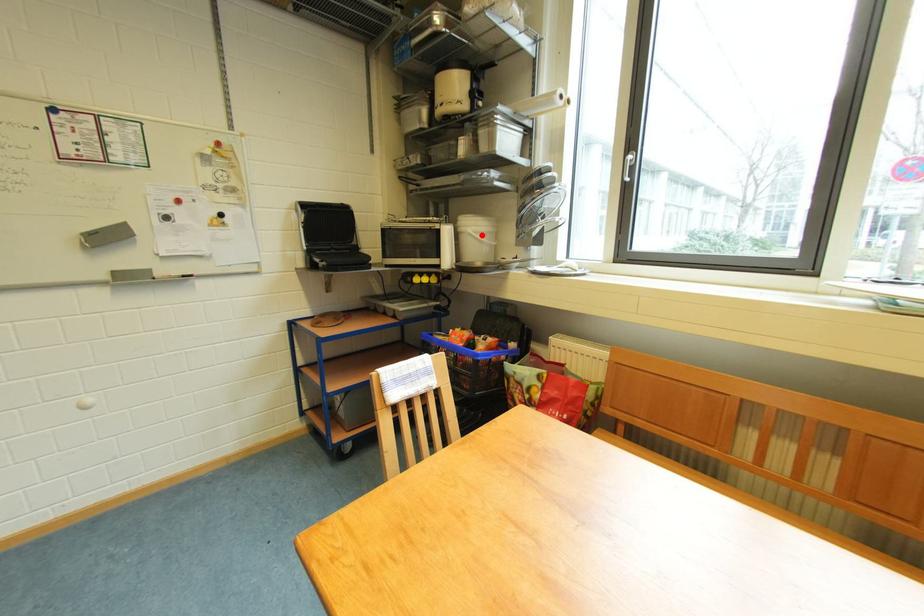
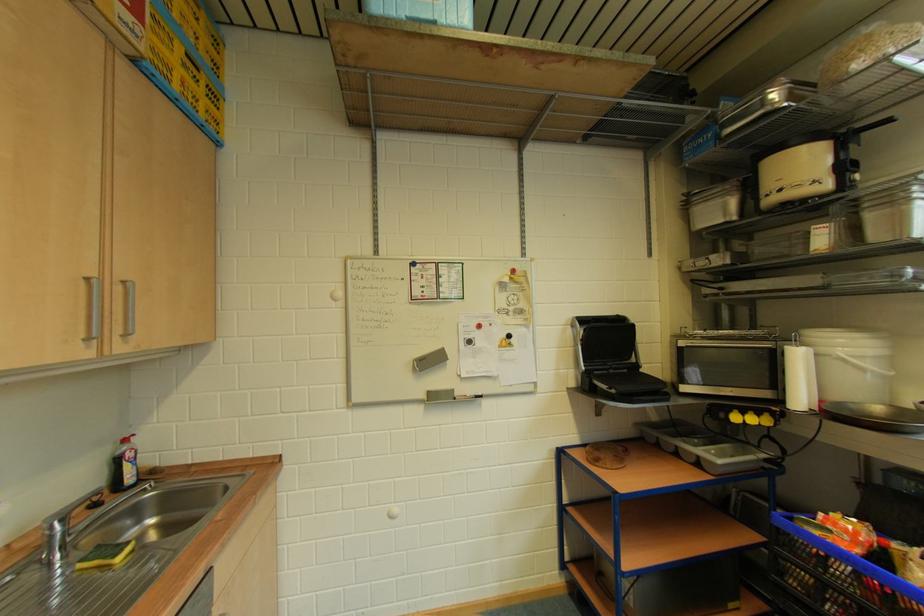
In the second image, find the point that corresponds to the highlighted location in the first image.

(858, 360)